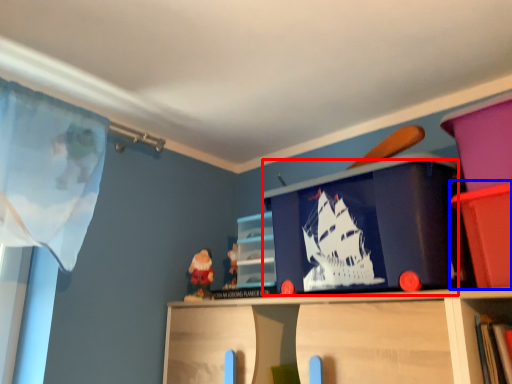
Question: Which point is further to the camera, window screen (highlighted by a red box) or cabinet (highlighted by a blue box)?

Choices:
 (A) window screen
 (B) cabinet

Answer: (A)